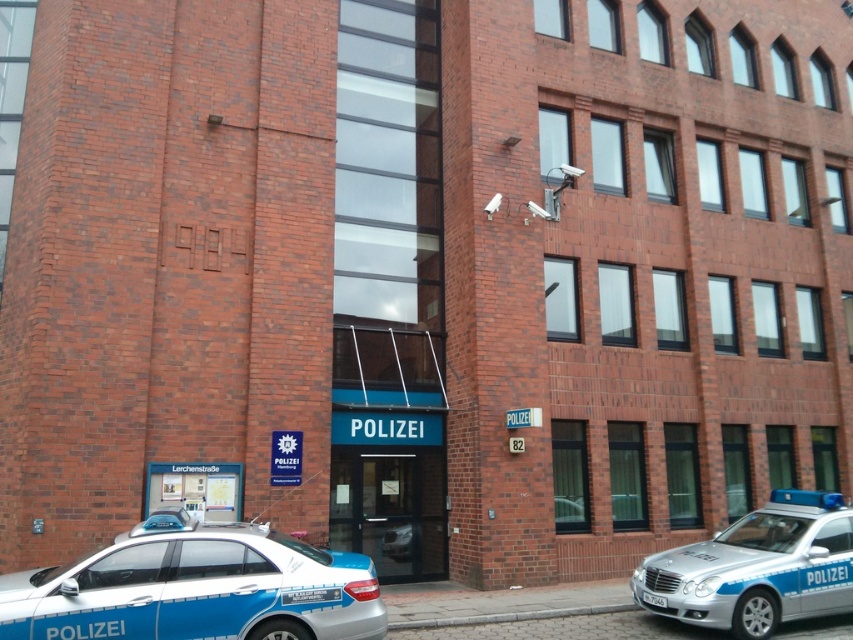
Who is shorter, blue metallic police car at lower left or silver metallic police car at lower right?

With less height is blue metallic police car at lower left.

Is point (171, 595) more distant than point (701, 570)?

No, (171, 595) is closer to viewer.

You are a GUI agent. You are given a task and a screenshot of the screen. Output one action in this format:
    pyautogui.click(x=<x>, y=<y>)
    Task: Click on the blue metallic police car at lower left
    Image resolution: width=853 pixels, height=640 pixels.
    Given the screenshot: What is the action you would take?
    pyautogui.click(x=196, y=589)